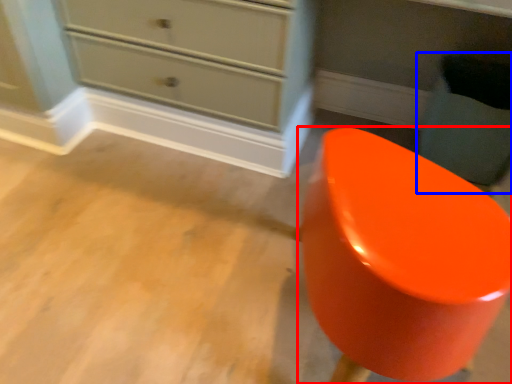
Question: Which object is closer to the camera taking this photo, furniture (highlighted by a red box) or swivel chair (highlighted by a blue box)?

Choices:
 (A) furniture
 (B) swivel chair

Answer: (A)